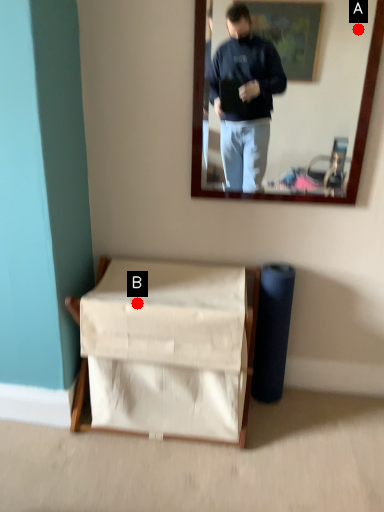
Question: Two points are circled on the image, labeled by A and B beside each circle. Among these points, which one is farthest from the camera?

Choices:
 (A) A is further
 (B) B is further

Answer: (A)